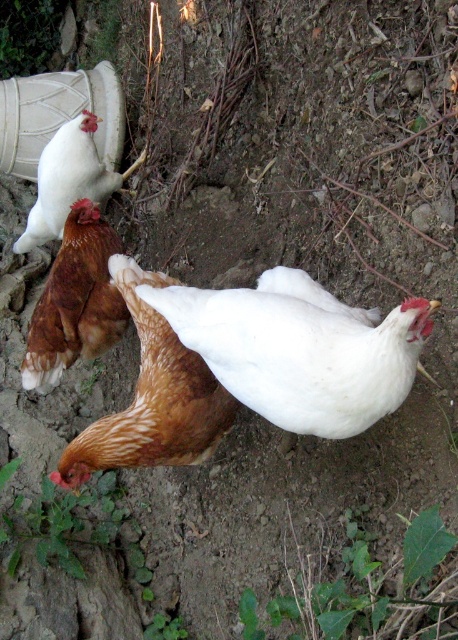
You are a farmer checking on your chickens. You see the brown speckled chicken at center and the brown feathered chicken at upper left. Which chicken is positioned more to the right side of the scene?

The brown speckled chicken at center is positioned more to the right side of the scene than the brown feathered chicken at upper left.